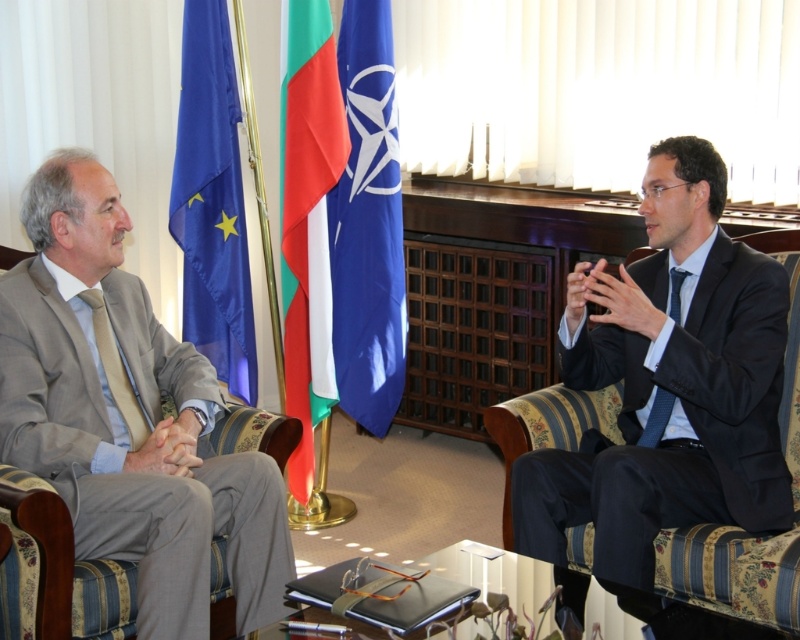
Is point (237, 307) positioned before point (145, 440)?

That is False.

Identify the location of blue fabric flag at left. This screenshot has height=640, width=800. (212, 202).

Who is more distant from viewer, (204,0) or (138,410)?

The point (204,0) is more distant.

Where is `blue fabric flag at left`? The image size is (800, 640). blue fabric flag at left is located at coordinates (212, 202).

Between point (57, 339) and point (296, 308), which one is positioned in front?

Point (57, 339)

What do you see at coordinates (128, 416) in the screenshot?
I see `light beige suit at left` at bounding box center [128, 416].

Between point (196, 397) and point (286, 134), which one is positioned behind?

The point (286, 134) is behind.

Locate an element on the screen. This screenshot has height=640, width=800. light beige suit at left is located at coordinates (128, 416).

Is blue fabric flag at left to the right of bright red fabric flag at center from the viewer's perspective?

Incorrect, blue fabric flag at left is not on the right side of bright red fabric flag at center.

Which is behind, point (200, 96) or point (288, 180)?

Positioned behind is point (200, 96).

In order to click on blue fabric flag at left in this screenshot , I will do `click(212, 202)`.